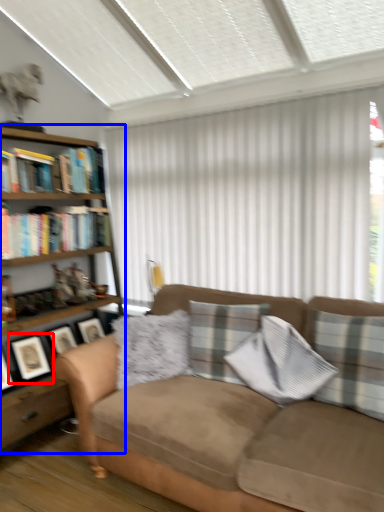
Question: Which object appears farthest to the camera in this image, picture frame (highlighted by a red box) or bookcase (highlighted by a blue box)?

Choices:
 (A) picture frame
 (B) bookcase

Answer: (A)